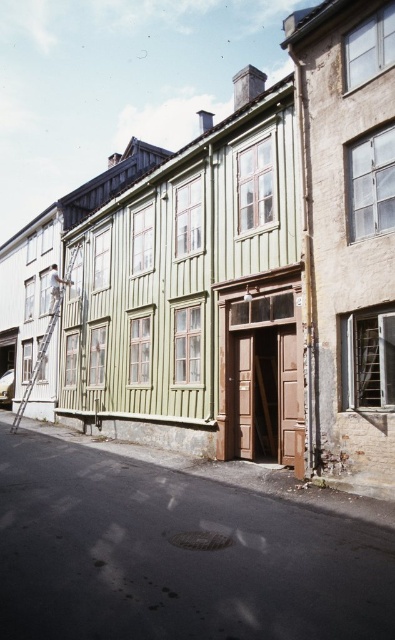
You are a painter who needs to reach the higher parts of the green building. You have a metallic silver ladder at left and a light brown wooden ladder at upper left. Which ladder is positioned to the left side of the other?

The metallic silver ladder at left is positioned to the left of the light brown wooden ladder at upper left.

You are a painter who needs to choose a ladder to reach the higher parts of the green building. The metallic silver ladder at left and the light brown wooden ladder at upper left are available. Which ladder has a wider base for better stability?

The metallic silver ladder at left has a larger width than the light brown wooden ladder at upper left, so it provides better stability.